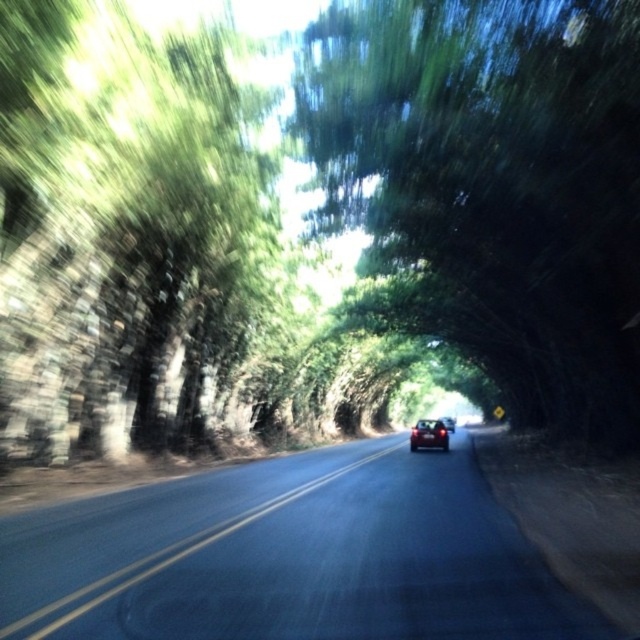
Question: Which of the following is the closest to the observer?

Choices:
 (A) (448, 433)
 (B) (451, 420)
 (C) (266, 598)
 (D) (627, 12)

Answer: (C)

Question: Can you confirm if green leafy tree at center is bigger than glossy red car at center?

Choices:
 (A) yes
 (B) no

Answer: (B)

Question: Does green leafy tree at center come behind satin black car at center?

Choices:
 (A) no
 (B) yes

Answer: (A)

Question: Can you confirm if asphalt road at center is wider than glossy red car at center?

Choices:
 (A) yes
 (B) no

Answer: (B)

Question: Which object appears closest to the camera in this image?

Choices:
 (A) glossy red car at center
 (B) satin black car at center

Answer: (B)

Question: Which point is farther to the camera?

Choices:
 (A) green leafy tree at center
 (B) satin black car at center

Answer: (B)